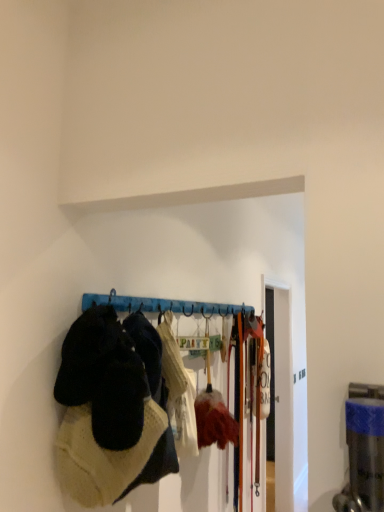
Where is `knitted wool sweater at left`? Image resolution: width=384 pixels, height=512 pixels. knitted wool sweater at left is located at coordinates (116, 404).

Describe the element at coordinates (116, 404) in the screenshot. I see `knitted wool sweater at left` at that location.

Where is `knitted wool sweater at left`? This screenshot has width=384, height=512. knitted wool sweater at left is located at coordinates (116, 404).